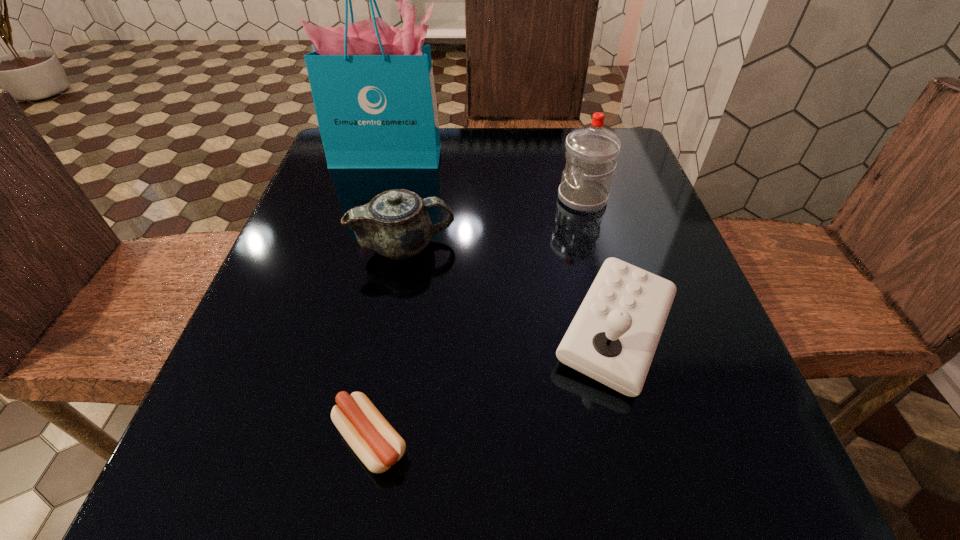
This screenshot has height=540, width=960. Identify the location of joystick present at the right edge. (613, 337).

At what (x,y) coordinates should I click in order to perform the action: click on object that is at the far left corner. Please return your answer as a coordinate pair (x, y). The image size is (960, 540). Looking at the image, I should click on pyautogui.click(x=372, y=84).

Image resolution: width=960 pixels, height=540 pixels. I want to click on free space at the far edge of the desktop, so click(468, 160).

In the image, there is a desktop. What are the coordinates of `vacant area at the near edge` in the screenshot? It's located at (621, 485).

I want to click on free spot at the left edge of the desktop, so click(x=326, y=288).

The height and width of the screenshot is (540, 960). Find the location of `blank area at the right edge`. blank area at the right edge is located at coordinates (614, 197).

Where is `empty space that is in between the shopping bag and the joystick`? empty space that is in between the shopping bag and the joystick is located at coordinates (503, 244).

Image resolution: width=960 pixels, height=540 pixels. Find the location of `vacant point located between the shortest object and the farthest object`. vacant point located between the shortest object and the farthest object is located at coordinates (380, 298).

Locate an element on the screen. The image size is (960, 540). free space between the second nearest object and the third farthest object is located at coordinates (511, 288).

Locate an element on the screen. The image size is (960, 540). free space between the joystick and the shopping bag is located at coordinates (503, 244).